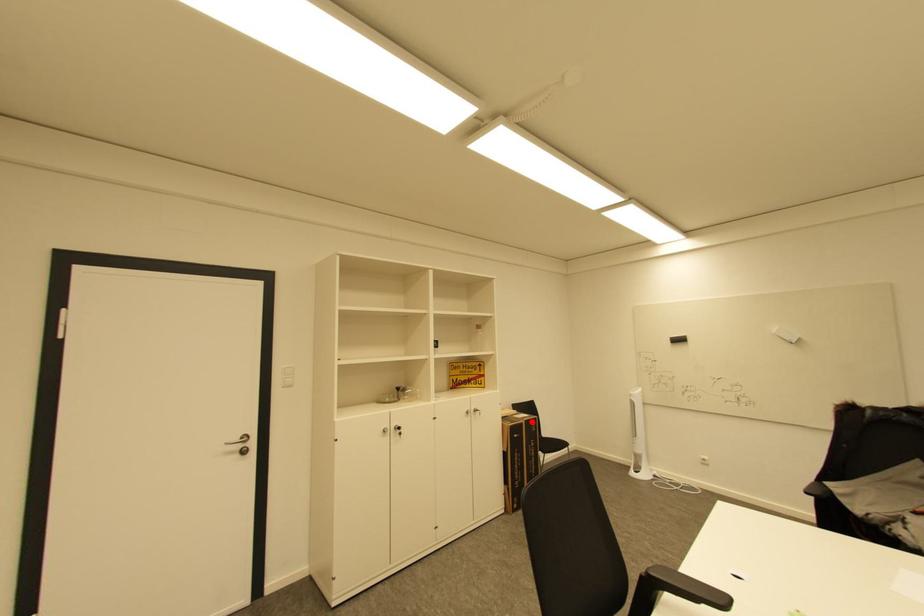
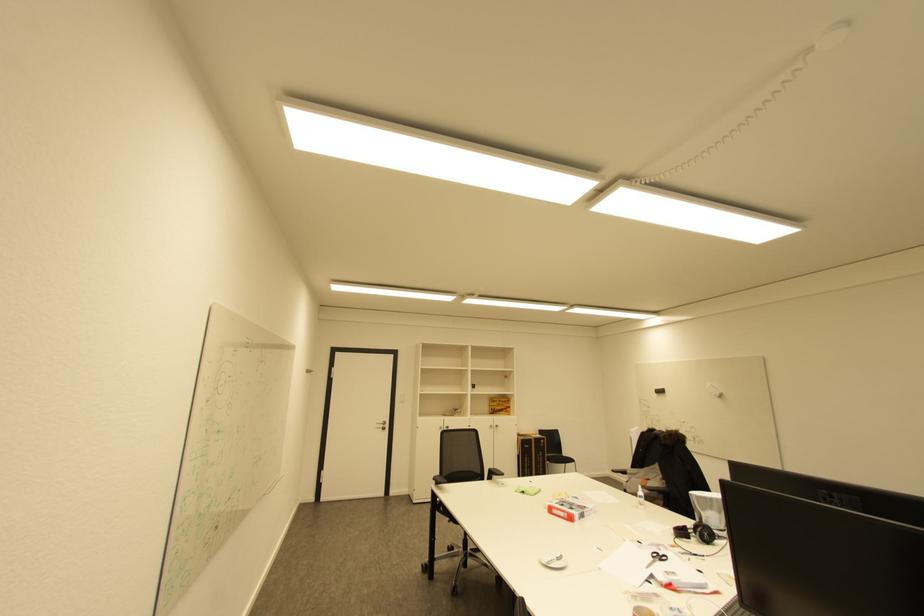
Question: I am providing you with two images of the same scene from different viewpoints. A red point is marked on the first image. At the location where the point appears in image 1, is it still visible in image 2?

Choices:
 (A) Yes
 (B) No

Answer: (A)